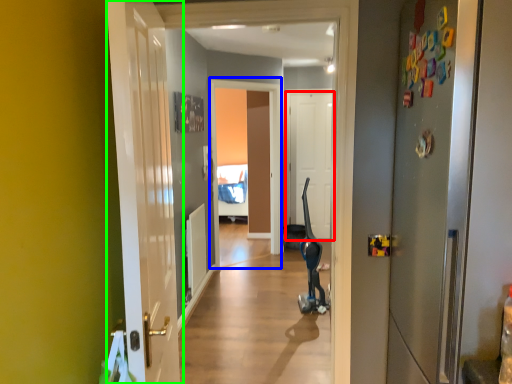
Question: Which is farther away from door (highlighted by a red box)? screen door (highlighted by a blue box) or door (highlighted by a green box)?

Choices:
 (A) screen door
 (B) door

Answer: (B)